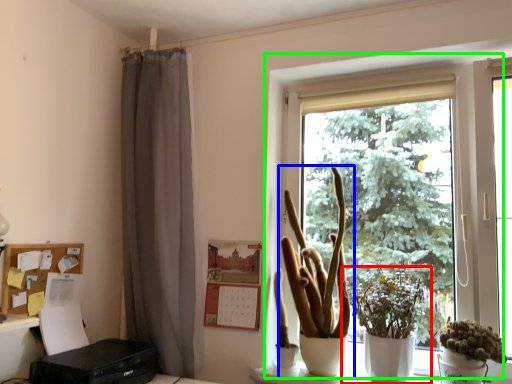
Question: Which is farther away from houseplant (highlighted by a red box)? houseplant (highlighted by a blue box) or window (highlighted by a green box)?

Choices:
 (A) houseplant
 (B) window

Answer: (B)